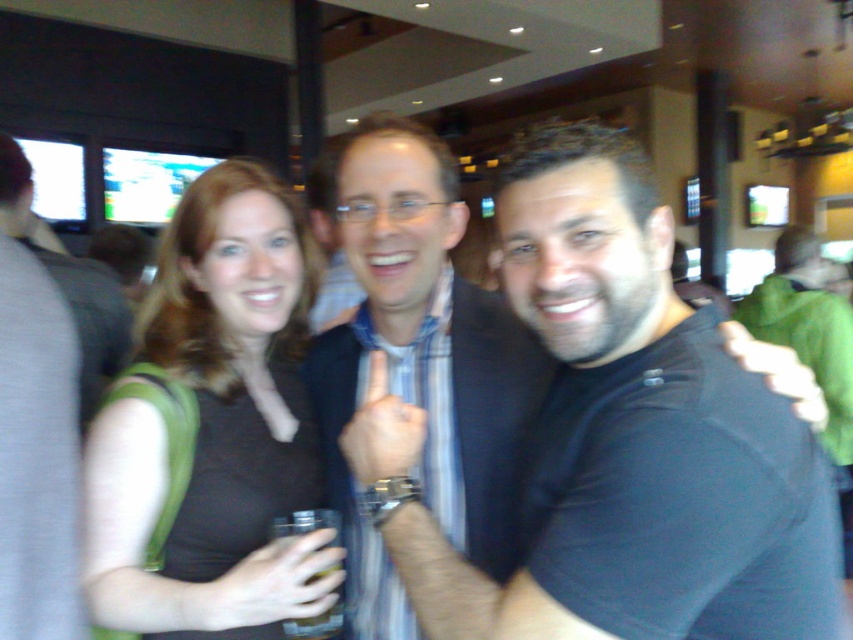
What are the coordinates of the black shirt at center in the image?

The coordinates of the black shirt at center are at point (593, 419).